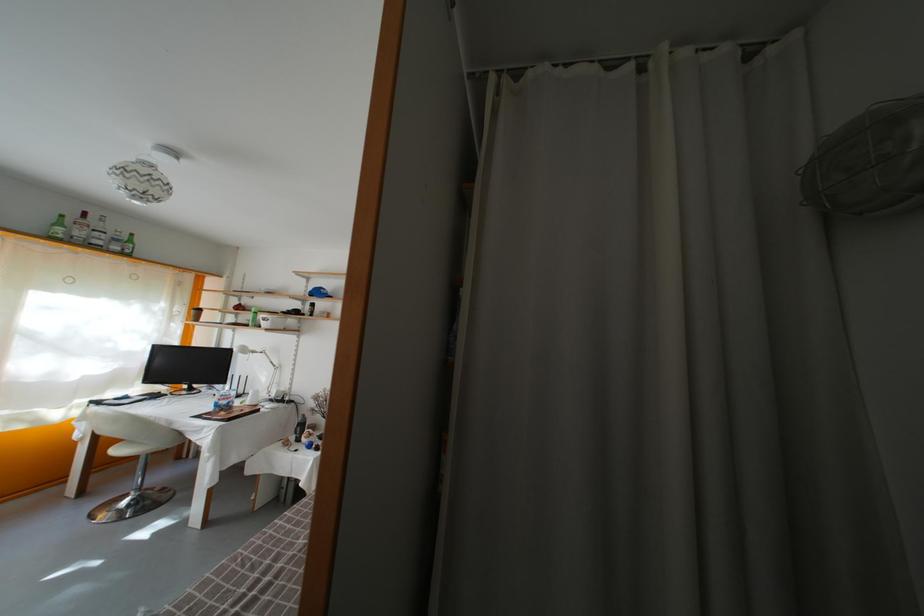
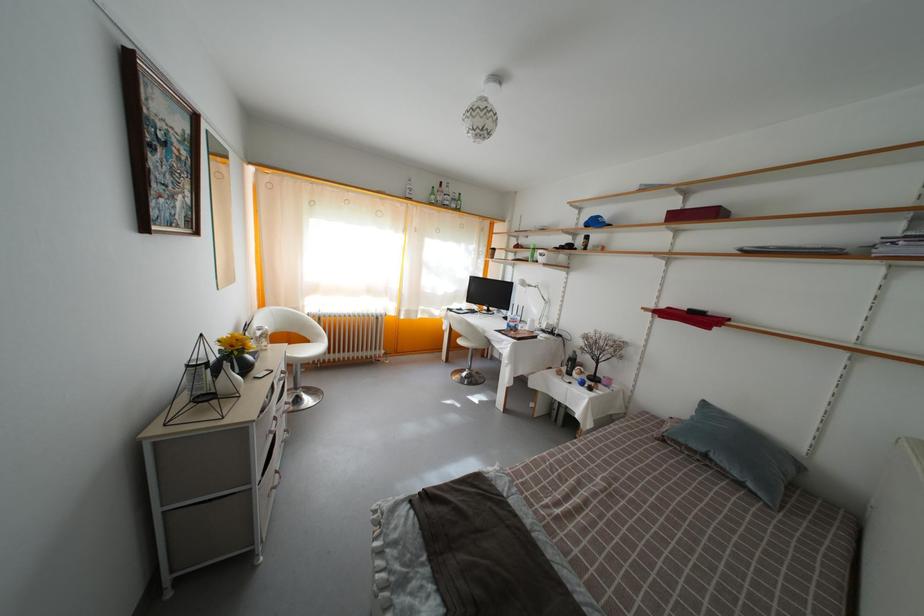
In the second image, find the point that corresponds to [257,355] in the first image.

(533, 289)